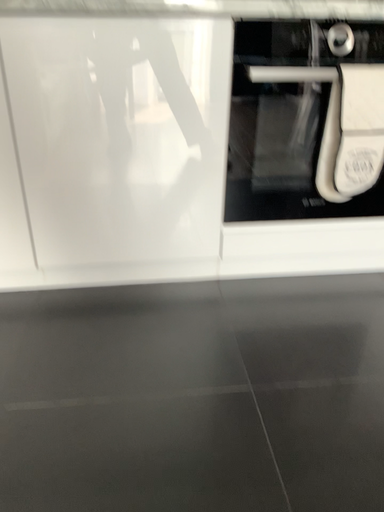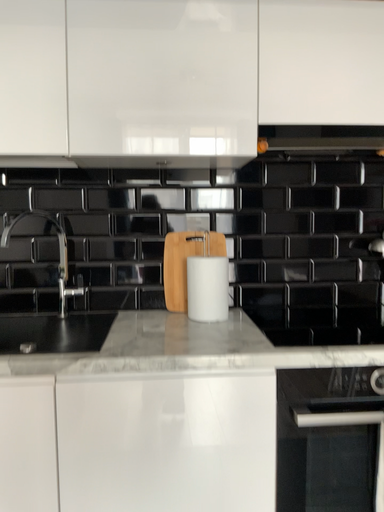
Question: Which way did the camera rotate in the video?

Choices:
 (A) rotated upward
 (B) rotated downward

Answer: (A)